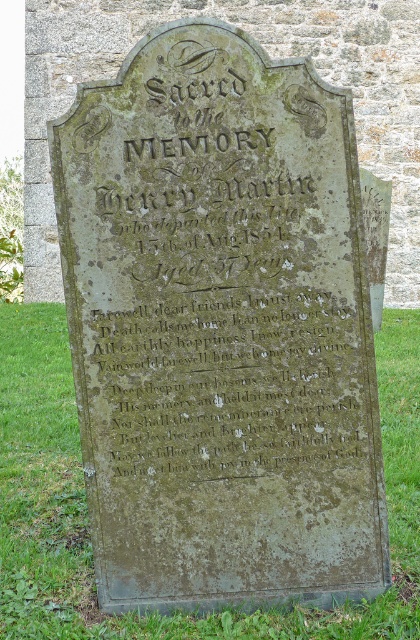
Question: Which object appears farthest from the camera in this image?

Choices:
 (A) green grass at lower center
 (B) green mossy stone inscription at center

Answer: (A)

Question: Is green grass at lower center behind green mossy stone inscription at center?

Choices:
 (A) yes
 (B) no

Answer: (A)

Question: Does green grass at lower center have a greater width compared to green mossy stone inscription at center?

Choices:
 (A) yes
 (B) no

Answer: (B)

Question: Which point is closer to the camera taking this photo?

Choices:
 (A) (215, 266)
 (B) (31, 627)

Answer: (B)

Question: Is green grass at lower center behind green mossy stone inscription at center?

Choices:
 (A) yes
 (B) no

Answer: (A)